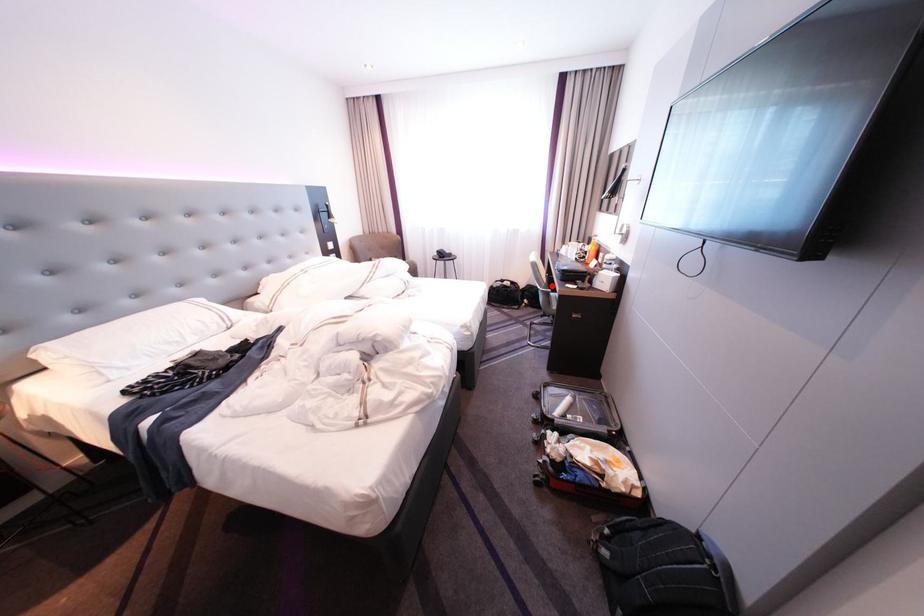
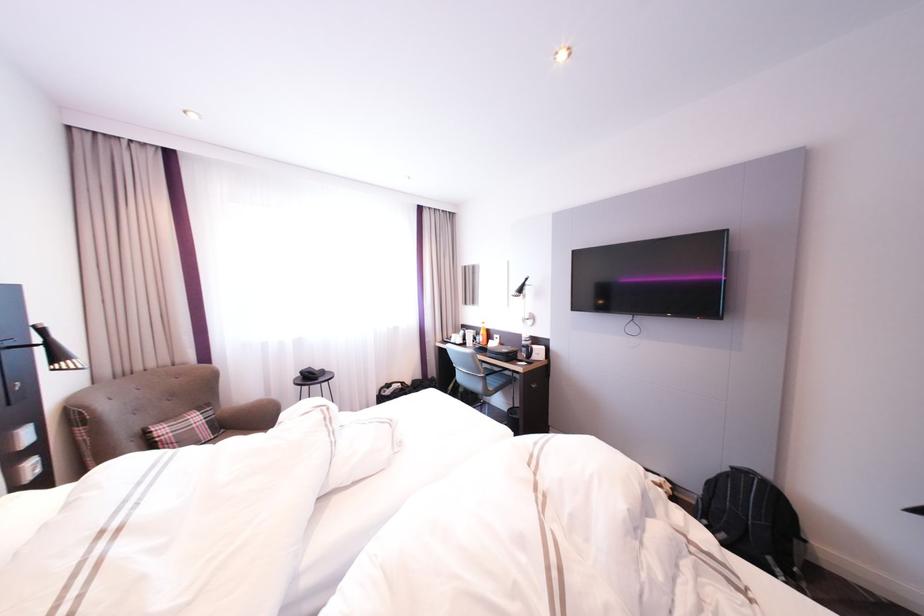
Question: I am providing you with two images of the same scene from different viewpoints. Image1 has a red point marked. In image2, the corresponding 3D location appears at what relative position? Reply with the corresponding letter.

Choices:
 (A) Closer
 (B) Farther

Answer: (B)